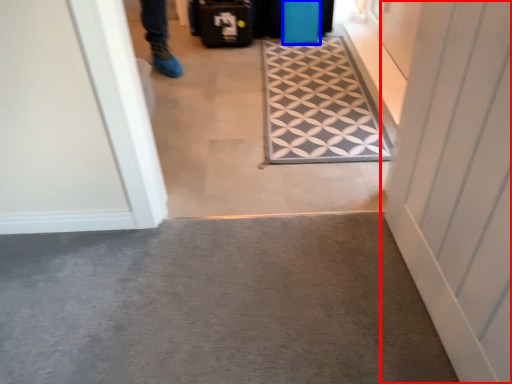
Question: Which object appears closest to the camera in this image, door (highlighted by a red box) or luggage (highlighted by a blue box)?

Choices:
 (A) door
 (B) luggage

Answer: (A)